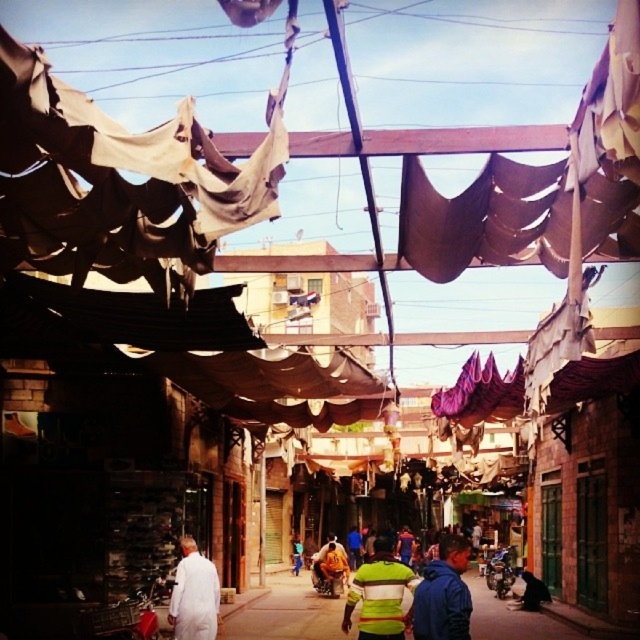
Question: Which of the following is the farthest from the observer?

Choices:
 (A) white fabric at center
 (B) yellow fabric at center
 (C) green jersey at center
 (D) white matte clothing at center

Answer: (A)

Question: Does green jersey at center have a smaller size compared to yellow fabric at center?

Choices:
 (A) no
 (B) yes

Answer: (A)

Question: Is green jersey at center bigger than yellow fabric at center?

Choices:
 (A) no
 (B) yes

Answer: (B)

Question: Does white matte clothing at center have a lesser width compared to yellow fabric at center?

Choices:
 (A) no
 (B) yes

Answer: (A)

Question: Estimate the real-world distances between objects in this image. Which object is farther from the yellow fabric at center?

Choices:
 (A) white matte clothing at center
 (B) blue fabric jacket at center

Answer: (B)

Question: Estimate the real-world distances between objects in this image. Which object is closer to the white matte clothing at center?

Choices:
 (A) white fabric at center
 (B) blue fabric jacket at center

Answer: (B)